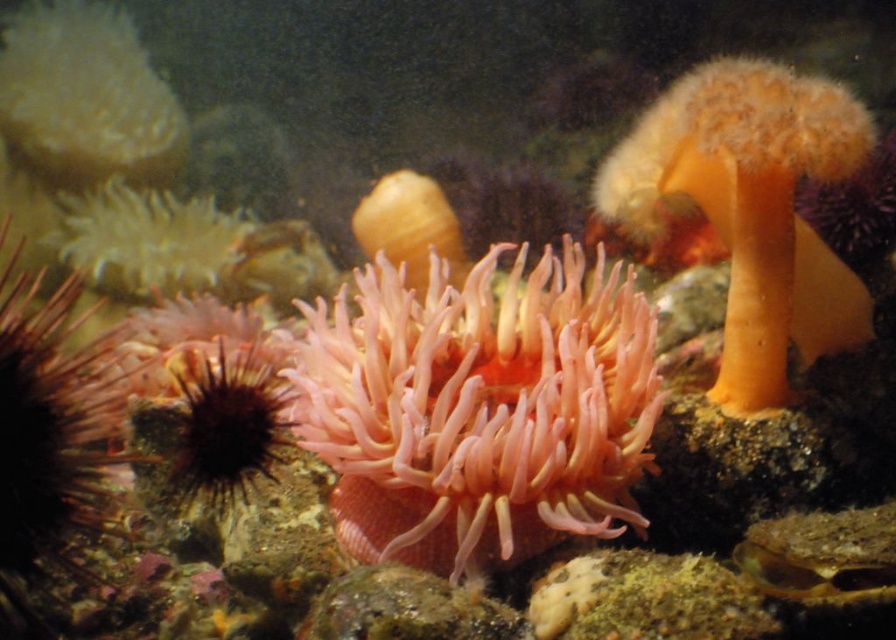
Question: Which point is farther to the camera?

Choices:
 (A) fuzzy yellow sponge at upper left
 (B) translucent yellowish coral at center
 (C) fuzzy orange anemone at upper right

Answer: (A)

Question: Which point is closer to the camera?

Choices:
 (A) (674, 129)
 (B) (452, 216)

Answer: (A)

Question: Which point is farther to the camera?

Choices:
 (A) fuzzy orange anemone at upper right
 (B) translucent pink coral at center
 (C) pink soft coral at center

Answer: (B)

Question: Considering the relative positions of fuzzy yellow sponge at upper left and translucent pink coral at center in the image provided, where is fuzzy yellow sponge at upper left located with respect to translucent pink coral at center?

Choices:
 (A) below
 (B) above

Answer: (B)

Question: Does fuzzy orange anemone at upper right have a smaller size compared to fuzzy yellow sponge at upper left?

Choices:
 (A) yes
 (B) no

Answer: (A)

Question: From the image, what is the correct spatial relationship of pink soft coral at center in relation to fuzzy yellow sponge at upper left?

Choices:
 (A) right
 (B) left

Answer: (A)